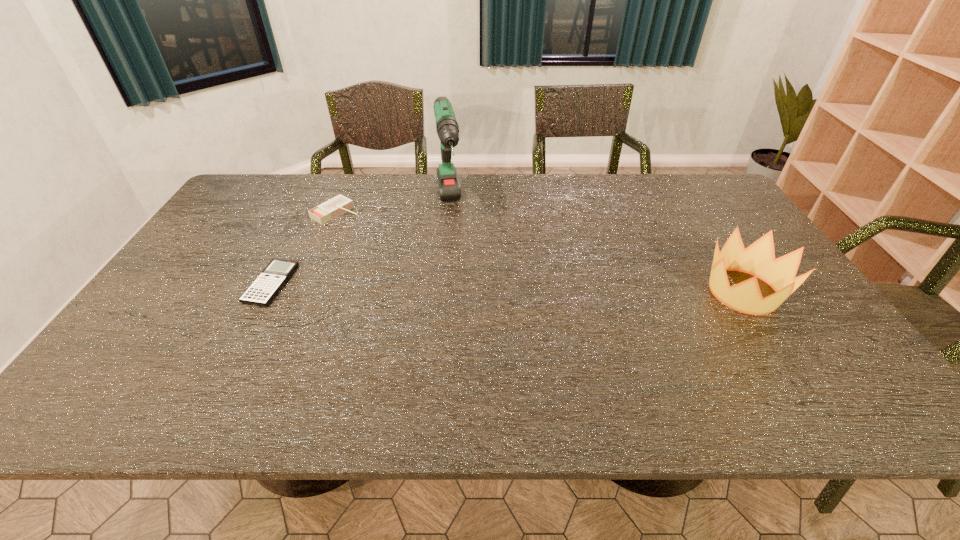
Find the location of a particular element. vacant region located on the striking surface of the second shortest object is located at coordinates (440, 269).

Locate an element on the screen. The image size is (960, 540). free point located 0.130m on the handle side of the tallest object is located at coordinates (452, 264).

You are a GUI agent. You are given a task and a screenshot of the screen. Output one action in this format:
    pyautogui.click(x=<x>, y=<y>)
    Task: Click on the vacant region located 0.170m on the handle side of the tallest object
    
    Given the screenshot: What is the action you would take?
    pyautogui.click(x=453, y=273)

Locate an element on the screen. The width and height of the screenshot is (960, 540). vacant space located 0.310m on the handle side of the tallest object is located at coordinates (459, 309).

At what (x,y) coordinates should I click in order to perform the action: click on matchbox that is positioned at the far edge. Please return your answer as a coordinate pair (x, y). The image size is (960, 540). Looking at the image, I should click on (340, 204).

This screenshot has width=960, height=540. I want to click on drill located at the far edge, so click(447, 127).

Find the location of a particular element. object present at the right edge is located at coordinates (758, 259).

Where is `vacant space at the far edge`? The height and width of the screenshot is (540, 960). vacant space at the far edge is located at coordinates (346, 192).

In the image, there is a desktop. Identify the location of vacant space at the near edge. Image resolution: width=960 pixels, height=540 pixels. (235, 358).

Locate an element on the screen. free location at the left edge of the desktop is located at coordinates (202, 316).